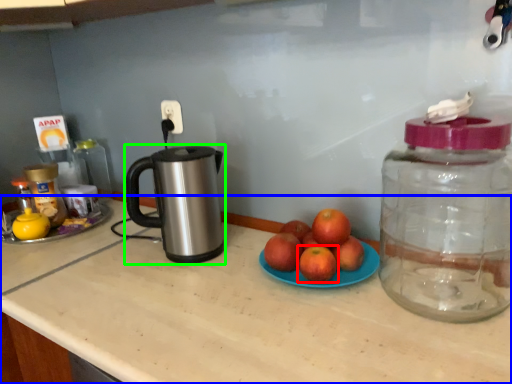
Question: Which is nearer to the grapefruit (highlighted by a red box)? countertop (highlighted by a blue box) or kettle (highlighted by a green box).

Choices:
 (A) countertop
 (B) kettle

Answer: (A)